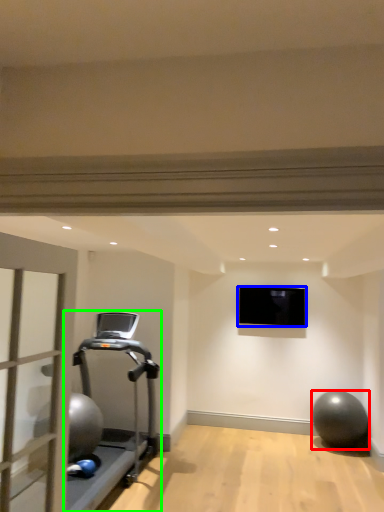
Question: Based on their relative distances, which object is nearer to ball (highlighted by a red box)? Choose from projection screen (highlighted by a blue box) and treadmill (highlighted by a green box).

Choices:
 (A) projection screen
 (B) treadmill

Answer: (A)